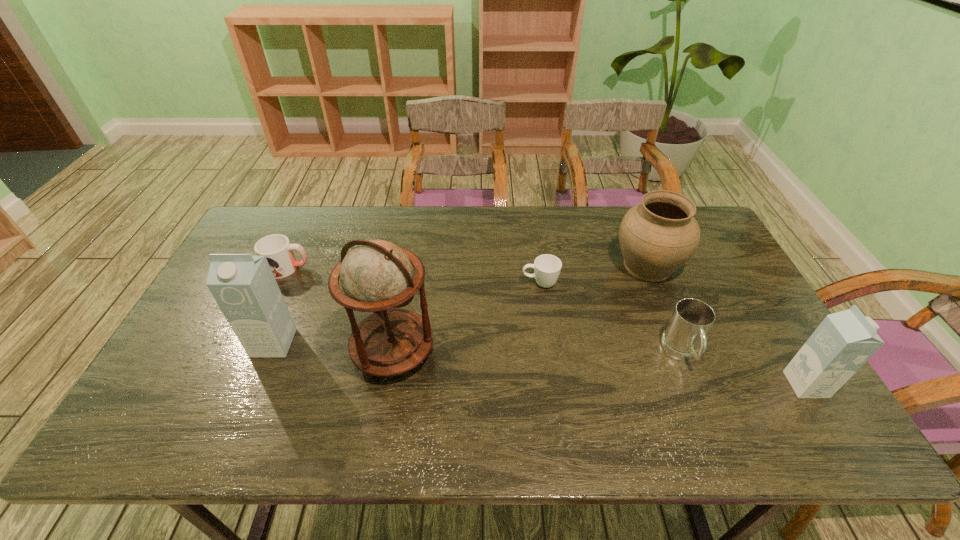
Where is `object located in the far edge section of the desktop`? The width and height of the screenshot is (960, 540). object located in the far edge section of the desktop is located at coordinates (657, 237).

This screenshot has height=540, width=960. I want to click on carton that is at the near edge, so click(x=844, y=341).

This screenshot has height=540, width=960. In order to click on mug present at the near edge in this screenshot , I will do `click(684, 339)`.

Identify the location of globe present at the near edge. Image resolution: width=960 pixels, height=540 pixels. (376, 276).

I want to click on object located in the left edge section of the desktop, so click(x=279, y=253).

At what (x,y) coordinates should I click in order to perform the action: click on carton at the right edge. Please return your answer as a coordinate pair (x, y). Looking at the image, I should click on (844, 341).

Where is `urn at the right edge`? The height and width of the screenshot is (540, 960). urn at the right edge is located at coordinates (657, 237).

Locate an element on the screen. Image resolution: width=960 pixels, height=540 pixels. object that is positioned at the far right corner is located at coordinates (657, 237).

Find the location of a particular element. The height and width of the screenshot is (540, 960). object at the near right corner is located at coordinates (844, 341).

You are a GUI agent. You are given a task and a screenshot of the screen. Output one action in this format:
    pyautogui.click(x=<x>, y=<y>)
    Task: Click on the free location at the far edge of the desktop
    This screenshot has width=960, height=540.
    Given the screenshot: What is the action you would take?
    pyautogui.click(x=568, y=220)